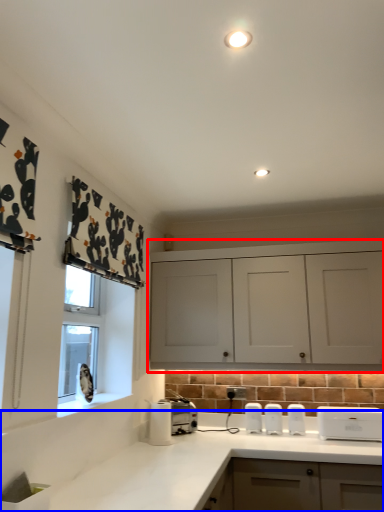
Question: Which object is closer to the camera taking this photo, cabinetry (highlighted by a red box) or countertop (highlighted by a blue box)?

Choices:
 (A) cabinetry
 (B) countertop

Answer: (B)